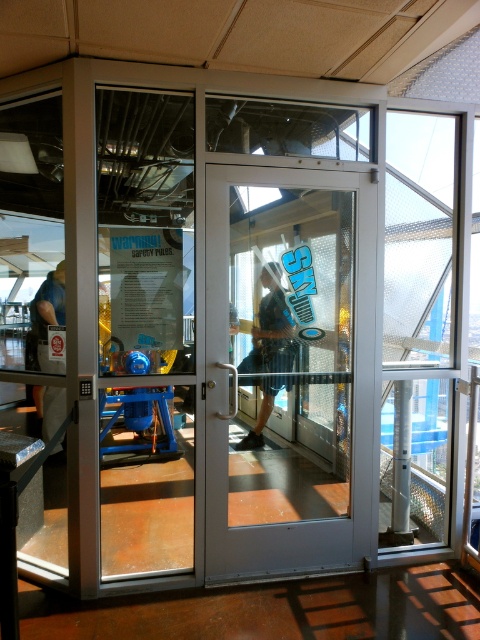
Who is positioned more to the left, blue denim shorts at center or matte black shirt at left?

Positioned to the left is matte black shirt at left.

Is blue denim shorts at center shorter than matte black shirt at left?

Yes.

Is point (288, 344) in front of point (54, 288)?

Yes, point (288, 344) is in front of point (54, 288).

Locate an element on the screen. blue denim shorts at center is located at coordinates (271, 328).

Between white glossy door at center and matte black shirt at left, which one has more height?

Standing taller between the two is white glossy door at center.

Can you confirm if white glossy door at center is shorter than matte black shirt at left?

No, white glossy door at center is not shorter than matte black shirt at left.

Is point (266, 497) farther from camera compared to point (49, 387)?

Yes, it is behind point (49, 387).

Find the location of a particular element. This screenshot has width=480, height=640. white glossy door at center is located at coordinates (288, 369).

Between white glossy door at center and blue denim shorts at center, which one is positioned higher?

blue denim shorts at center is higher up.

Between white glossy door at center and blue denim shorts at center, which one appears on the right side from the viewer's perspective?

white glossy door at center is more to the right.

What are the coordinates of `white glossy door at center` in the screenshot? It's located at (288, 369).

This screenshot has width=480, height=640. What are the coordinates of `white glossy door at center` in the screenshot? It's located at (288, 369).